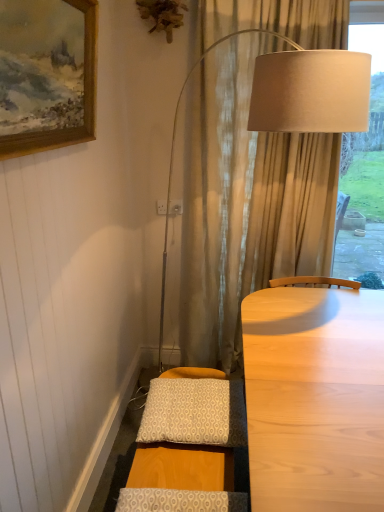
Question: Can you confirm if patterned fabric pillow at lower center, the 1th pillow from the back, is bigger than wooden framed painting at upper left?

Choices:
 (A) yes
 (B) no

Answer: (B)

Question: Is wooden framed painting at upper left completely or partially inside patterned fabric pillow at lower center, the second pillow in the front-to-back sequence?

Choices:
 (A) yes
 (B) no

Answer: (B)

Question: Is patterned fabric pillow at lower center, the second pillow in the front-to-back sequence, shorter than wooden framed painting at upper left?

Choices:
 (A) yes
 (B) no

Answer: (A)

Question: Is patterned fabric pillow at lower center, which ranks as the 1th pillow in top-to-bottom order, smaller than wooden framed painting at upper left?

Choices:
 (A) yes
 (B) no

Answer: (A)

Question: From the image's perspective, is patterned fabric pillow at lower center, the second pillow ordered from the bottom, on wooden framed painting at upper left?

Choices:
 (A) yes
 (B) no

Answer: (B)

Question: Is patterned fabric pillow at lower center, the second pillow in the front-to-back sequence, situated inside patterned fabric pillow at lower center, arranged as the second pillow when viewed from the back, or outside?

Choices:
 (A) outside
 (B) inside

Answer: (A)

Question: Considering the positions of patterned fabric pillow at lower center, the second pillow ordered from the bottom, and patterned fabric pillow at lower center, arranged as the second pillow when viewed from the back, in the image, is patterned fabric pillow at lower center, the second pillow ordered from the bottom, wider or thinner than patterned fabric pillow at lower center, arranged as the second pillow when viewed from the back,?

Choices:
 (A) thin
 (B) wide

Answer: (B)

Question: Considering the positions of patterned fabric pillow at lower center, the second pillow ordered from the bottom, and patterned fabric pillow at lower center, positioned as the first pillow in bottom-to-top order, in the image, is patterned fabric pillow at lower center, the second pillow ordered from the bottom, taller or shorter than patterned fabric pillow at lower center, positioned as the first pillow in bottom-to-top order,?

Choices:
 (A) short
 (B) tall

Answer: (B)

Question: Is point tap(188, 435) positioned closer to the camera than point tap(160, 497)?

Choices:
 (A) farther
 (B) closer

Answer: (A)

Question: Looking at their shapes, would you say wooden framed painting at upper left is wider or thinner than patterned fabric pillow at lower center, the second pillow in the front-to-back sequence?

Choices:
 (A) thin
 (B) wide

Answer: (A)

Question: Considering their positions, is wooden framed painting at upper left located in front of or behind patterned fabric pillow at lower center, the second pillow in the front-to-back sequence?

Choices:
 (A) front
 (B) behind

Answer: (A)

Question: In terms of height, does wooden framed painting at upper left look taller or shorter compared to patterned fabric pillow at lower center, the 1th pillow from the back?

Choices:
 (A) short
 (B) tall

Answer: (B)

Question: Considering the positions of point (46, 145) and point (231, 430), is point (46, 145) closer or farther from the camera than point (231, 430)?

Choices:
 (A) farther
 (B) closer

Answer: (B)

Question: From a real-world perspective, relative to wooden framed painting at upper left, is patterned fabric pillow at lower center, the 1th pillow from the back, vertically above or below?

Choices:
 (A) below
 (B) above

Answer: (A)

Question: Looking at the image, does patterned fabric pillow at lower center, the second pillow ordered from the bottom, seem bigger or smaller compared to wooden framed painting at upper left?

Choices:
 (A) big
 (B) small

Answer: (B)